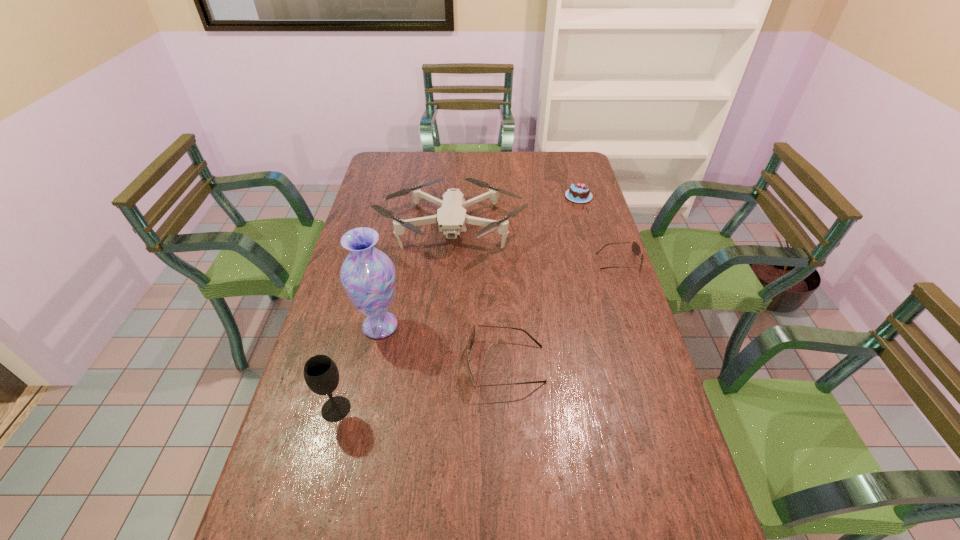
Identify the location of free space at the far edge of the desktop. The height and width of the screenshot is (540, 960). (550, 178).

In the image, there is a desktop. Identify the location of vacant space at the near edge. The width and height of the screenshot is (960, 540). (415, 519).

I want to click on free space at the left edge, so (x=394, y=201).

Find the location of a particular element. vacant area at the right edge of the desktop is located at coordinates (627, 315).

Image resolution: width=960 pixels, height=540 pixels. In the image, there is a desktop. What are the coordinates of `vacant space at the far left corner` in the screenshot? It's located at (372, 174).

Identify the location of free space at the far right corner. The width and height of the screenshot is (960, 540). (578, 162).

Where is `vacant region at the near right corner`? Image resolution: width=960 pixels, height=540 pixels. vacant region at the near right corner is located at coordinates (685, 504).

Where is `vacant space that is in between the vase and the fourth shortest object`? This screenshot has height=540, width=960. vacant space that is in between the vase and the fourth shortest object is located at coordinates (416, 276).

At what (x,y) coordinates should I click in order to perform the action: click on vacant space in between the second shortest object and the fifth shortest object. Please return your answer as a coordinate pair (x, y). This screenshot has width=960, height=540. Looking at the image, I should click on (457, 302).

Image resolution: width=960 pixels, height=540 pixels. What are the coordinates of `vacant area that lies between the shortest object and the vase` in the screenshot? It's located at (499, 294).